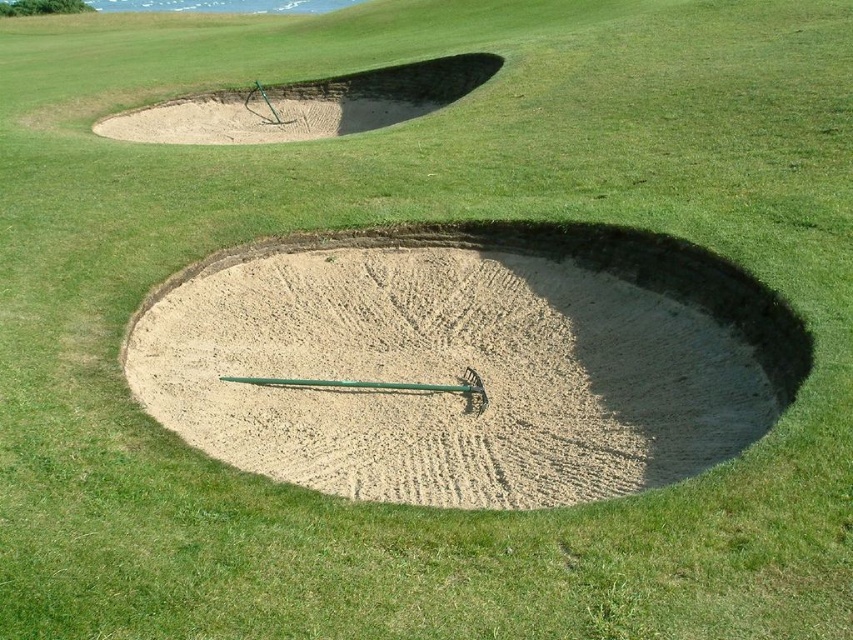
Who is lower down, smooth sand rake at center or smooth sand trap at upper left?

Positioned lower is smooth sand rake at center.

Based on the photo, is smooth sand rake at center to the right of smooth sand trap at upper left from the viewer's perspective?

Yes, smooth sand rake at center is to the right of smooth sand trap at upper left.

Is point (288, 360) closer to camera compared to point (415, 106)?

Yes.

Identify the location of smooth sand rake at center. This screenshot has height=640, width=853. (463, 362).